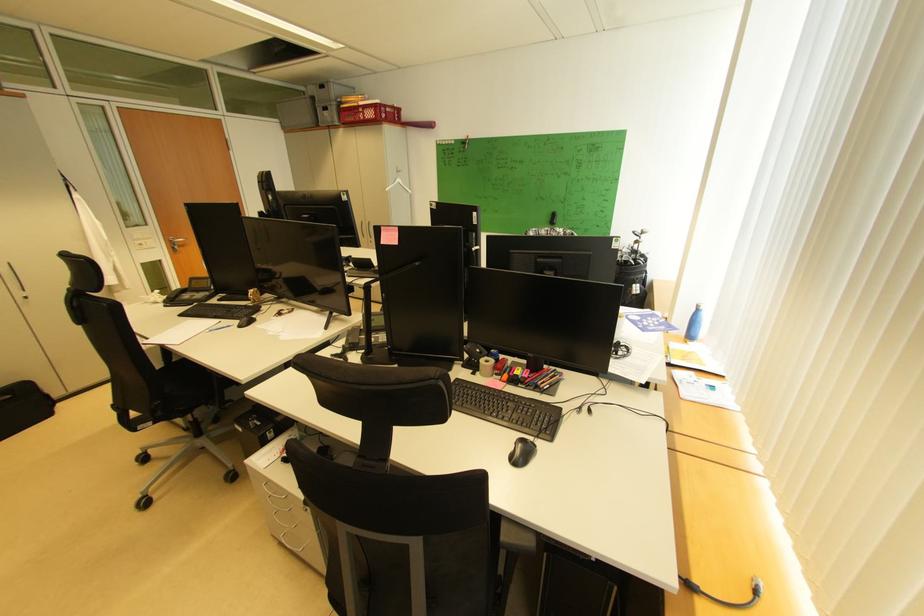
Where is `black chair surface`? The height and width of the screenshot is (616, 924). black chair surface is located at coordinates (175, 383).